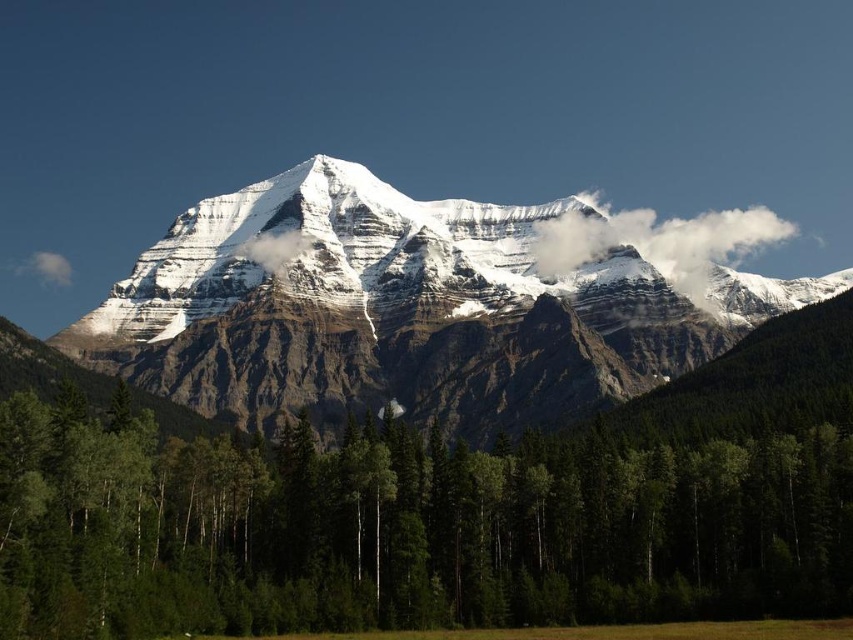
At what (x,y) coordinates should I click in order to perform the action: click on green matte tree at center. Please return your answer as a coordinate pair (x, y). This screenshot has height=640, width=853. Looking at the image, I should click on (401, 531).

Between green matte tree at center and snowy granite mountain range at center, which one is positioned higher?

Positioned higher is snowy granite mountain range at center.

What do you see at coordinates (401, 531) in the screenshot?
I see `green matte tree at center` at bounding box center [401, 531].

Locate an element on the screen. This screenshot has height=640, width=853. green matte tree at center is located at coordinates click(401, 531).

Between snowy granite mountain range at center and white fluffy cloud at upper right, which one has more height?

Standing taller between the two is snowy granite mountain range at center.

Between point (665, 339) and point (727, 227), which one is positioned behind?

Point (727, 227)

Where is `snowy granite mountain range at center`? Image resolution: width=853 pixels, height=640 pixels. snowy granite mountain range at center is located at coordinates (402, 308).

At what (x,y) coordinates should I click in order to perform the action: click on snowy granite mountain range at center. Please return your answer as a coordinate pair (x, y). Looking at the image, I should click on (402, 308).

Who is taller, green matte tree at center or white fluffy cloud at upper right?

With more height is green matte tree at center.

Is point (274, 582) behind point (544, 262)?

No, it is not.

Does point (183, 561) come in front of point (608, 237)?

Yes, point (183, 561) is closer to viewer.

The image size is (853, 640). I want to click on green matte tree at center, so click(x=401, y=531).